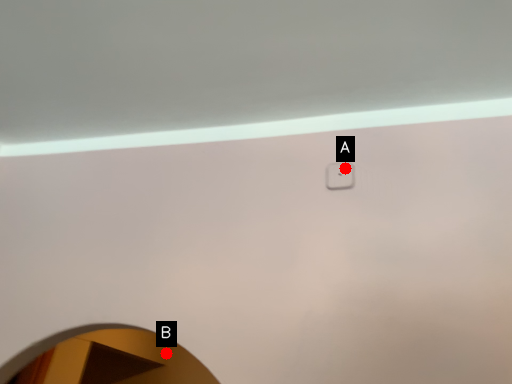
Question: Two points are circled on the image, labeled by A and B beside each circle. Which of the following is the farthest from the observer?

Choices:
 (A) A is further
 (B) B is further

Answer: (B)